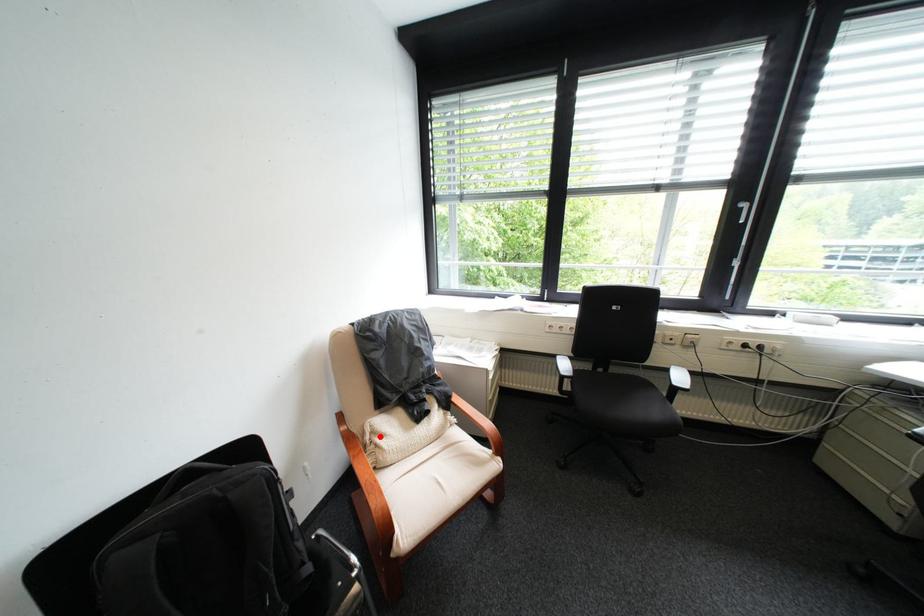
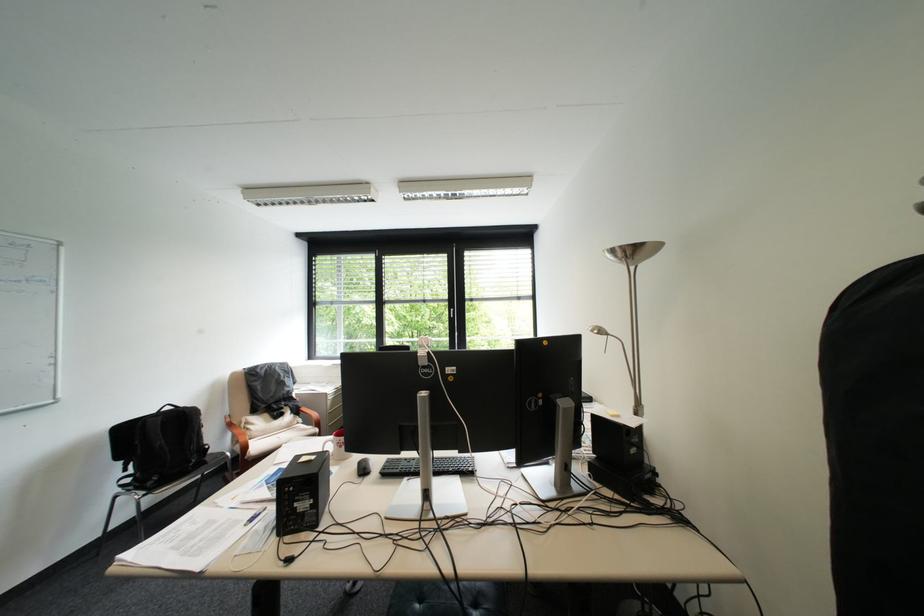
In the second image, find the point that corresponds to the highlighted location in the first image.

(256, 424)